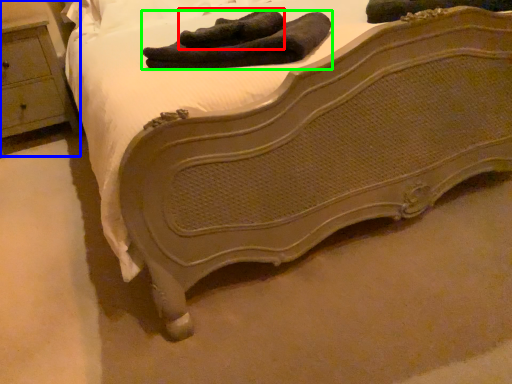
Question: Which is farther away from footwear (highlighted by a red box)? nightstand (highlighted by a blue box) or footwear (highlighted by a green box)?

Choices:
 (A) nightstand
 (B) footwear

Answer: (A)